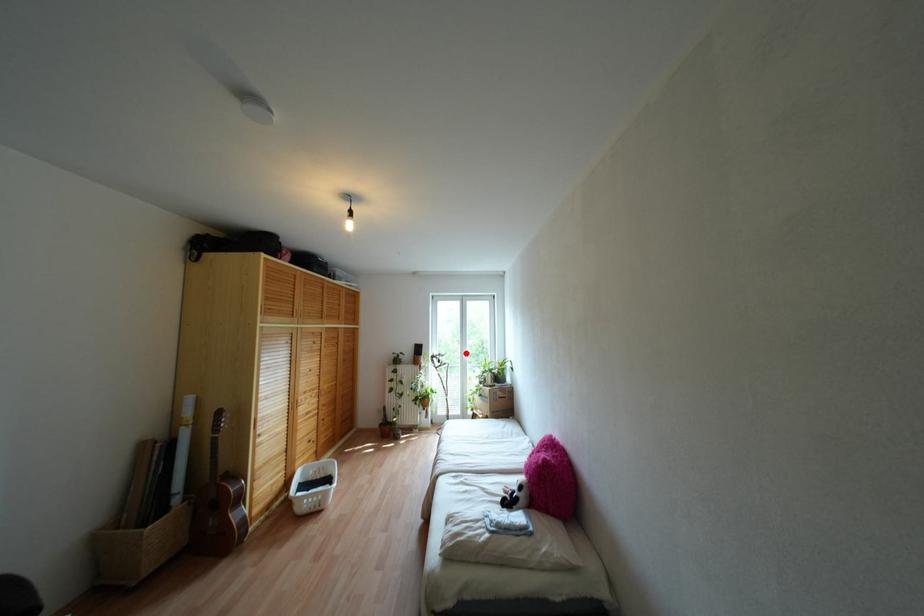
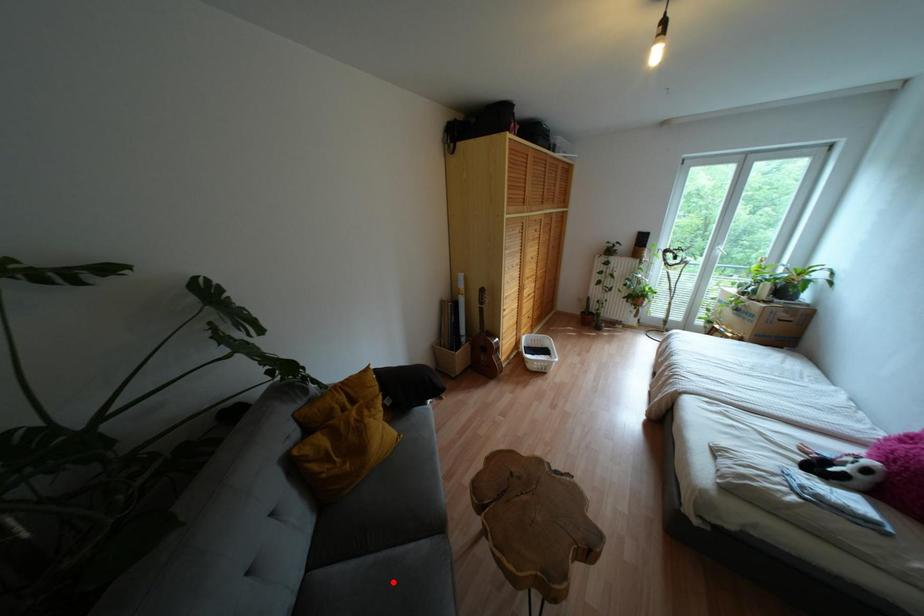
I am providing you with two images of the same scene from different viewpoints. A red point is marked on the first image and another point is marked on the second image. Does the point marked in image1 correspond to the same location as the one in image2?

No